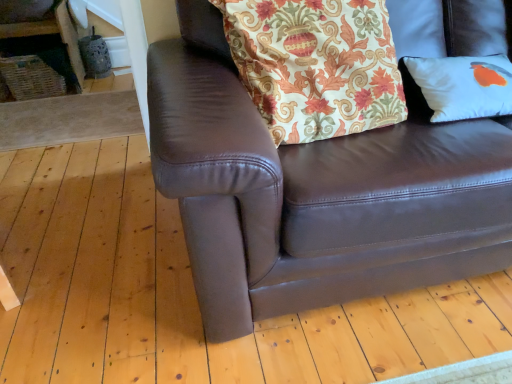
Question: From a real-world perspective, is floral fabric pillow at upper center above or below white matte pillow at right?

Choices:
 (A) above
 (B) below

Answer: (A)

Question: Is floral fabric pillow at upper center taller or shorter than white matte pillow at right?

Choices:
 (A) short
 (B) tall

Answer: (B)

Question: Which object is positioned farthest from the brown leather couch at center?

Choices:
 (A) white matte pillow at right
 (B) floral fabric pillow at upper center

Answer: (A)

Question: Which object is the farthest from the brown leather couch at center?

Choices:
 (A) floral fabric pillow at upper center
 (B) white matte pillow at right

Answer: (B)